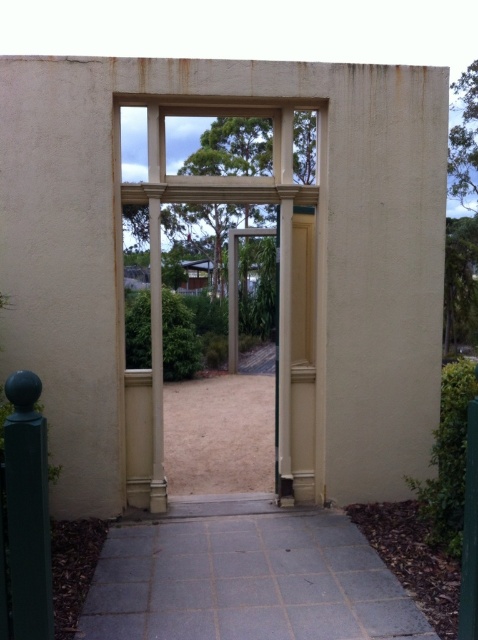
Question: Among these objects, which one is farthest from the camera?

Choices:
 (A) gray concrete path at center
 (B) matte cream column at center

Answer: (B)

Question: Can you confirm if gray concrete path at center is smaller than beige stone door at center?

Choices:
 (A) no
 (B) yes

Answer: (A)

Question: Is beige stone door at center below matte cream column at center?

Choices:
 (A) yes
 (B) no

Answer: (B)

Question: Which object is farther from the camera taking this photo?

Choices:
 (A) matte cream column at center
 (B) dark green polished post at left

Answer: (A)

Question: Which point is farther to the camera?

Choices:
 (A) beige stone door at center
 (B) dark green polished post at left
 (C) matte cream column at center

Answer: (C)

Question: Is beige stone door at center wider than dark green polished post at left?

Choices:
 (A) yes
 (B) no

Answer: (A)